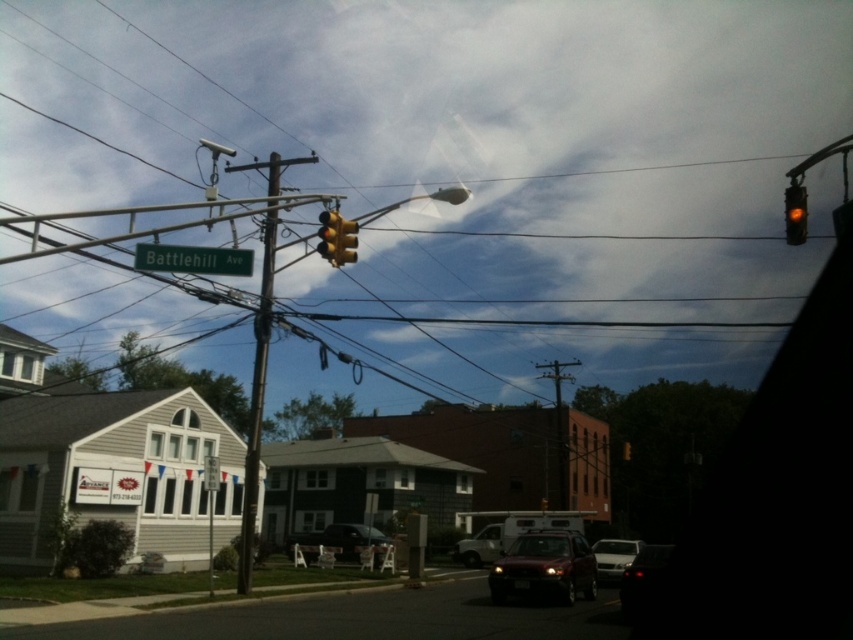
Question: Estimate the real-world distances between objects in this image. Which object is farther from the metallic gray telegraph pole at center-right?

Choices:
 (A) white matte sedan at center
 (B) metallic silver van at center

Answer: (A)

Question: Which of the following is the farthest from the observer?

Choices:
 (A) (492, 561)
 (B) (602, 540)
 (C) (537, 552)

Answer: (A)

Question: Estimate the real-world distances between objects in this image. Which object is closer to the white matte sedan at center?

Choices:
 (A) green metallic street sign at upper center
 (B) shiny black car at lower right

Answer: (B)

Question: Is metallic silver sedan at center smaller than yellow matte traffic light at upper right?

Choices:
 (A) yes
 (B) no

Answer: (A)

Question: From the image, what is the correct spatial relationship of metallic silver van at center in relation to white matte sedan at center?

Choices:
 (A) below
 (B) above

Answer: (A)

Question: In this image, where is green metallic street sign at upper center located relative to yellow matte traffic light at center?

Choices:
 (A) left
 (B) right

Answer: (A)